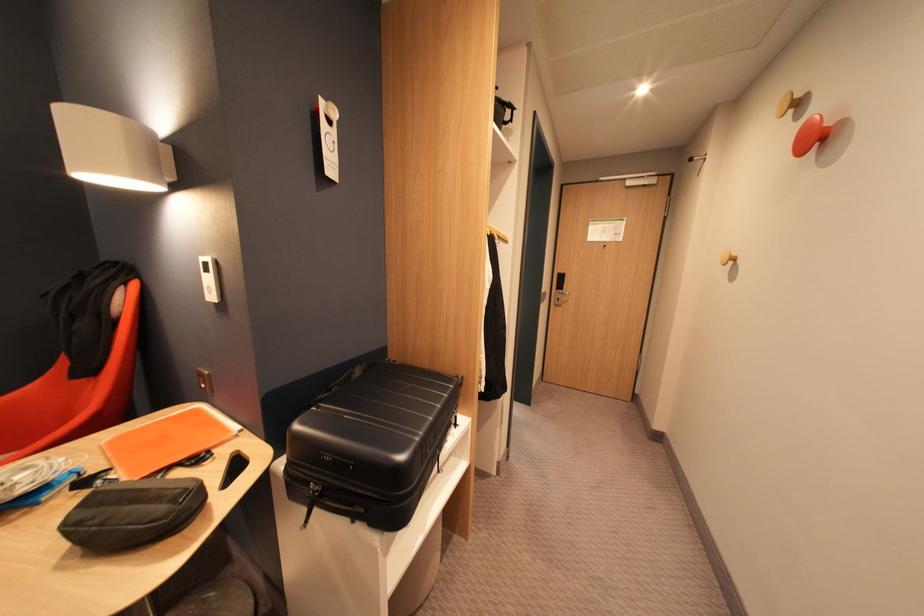
This screenshot has height=616, width=924. What do you see at coordinates (209, 278) in the screenshot?
I see `the white wall switch` at bounding box center [209, 278].